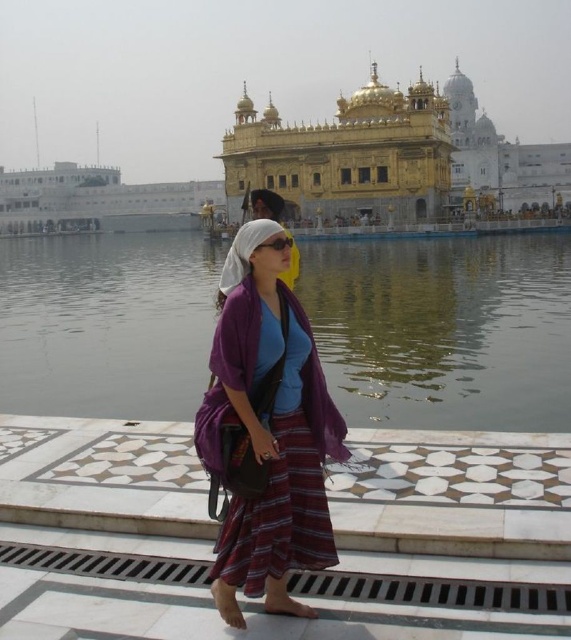
Who is more distant from viewer, (x=412, y=257) or (x=247, y=580)?

Positioned behind is point (x=412, y=257).

Can you confirm if transparent water at center is positioned above purple fabric scarf at center?

Yes.

Between point (139, 272) and point (283, 509), which one is positioned in front?

Positioned in front is point (283, 509).

The height and width of the screenshot is (640, 571). I want to click on transparent water at center, so click(x=444, y=330).